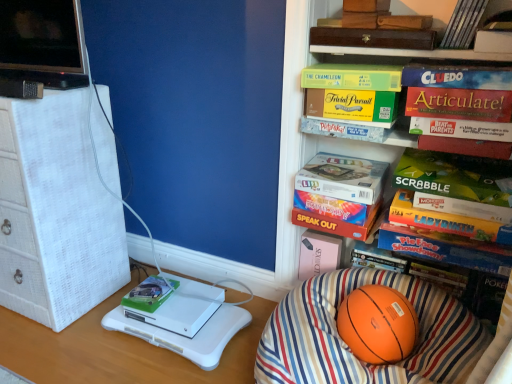
Question: Could green matte board game at upper center, the eleventh paperback book from the bottom, be considered to be inside hardcover book at center, the twelfth paperback book positioned from the top?

Choices:
 (A) yes
 (B) no

Answer: (B)

Question: Does hardcover book at center, the twelfth paperback book positioned from the top, have a greater width compared to green matte board game at upper center, which is the second paperback book from top to bottom?

Choices:
 (A) yes
 (B) no

Answer: (B)

Question: Is the position of hardcover book at center, the twelfth paperback book positioned from the top, less distant than that of green matte board game at upper center, the eleventh paperback book from the bottom?

Choices:
 (A) no
 (B) yes

Answer: (A)

Question: Are hardcover book at center, which is the first paperback book from bottom to top, and green matte board game at upper center, the eleventh paperback book from the bottom, making contact?

Choices:
 (A) no
 (B) yes

Answer: (A)

Question: Is green matte board game at upper center, the eleventh paperback book from the bottom, at the back of hardcover book at center, which is the first paperback book from bottom to top?

Choices:
 (A) no
 (B) yes

Answer: (A)

Question: In the image, is green matte scrabble board game at center-right, which appears as the eighth paperback book when viewed from the top, positioned in front of or behind hardcover book at center, the twelfth paperback book positioned from the top?

Choices:
 (A) front
 (B) behind

Answer: (A)

Question: From a real-world perspective, is green matte scrabble board game at center-right, which appears as the eighth paperback book when viewed from the top, positioned above or below hardcover book at center, which is the first paperback book from bottom to top?

Choices:
 (A) above
 (B) below

Answer: (A)

Question: Do you think green matte scrabble board game at center-right, the fifth paperback book from the bottom, is within hardcover book at center, which is the first paperback book from bottom to top, or outside of it?

Choices:
 (A) inside
 (B) outside

Answer: (B)

Question: From the image's perspective, relative to hardcover book at center, the twelfth paperback book positioned from the top, is green matte scrabble board game at center-right, which appears as the eighth paperback book when viewed from the top, above or below?

Choices:
 (A) below
 (B) above

Answer: (B)

Question: In terms of height, does orange matte basketball at lower right look taller or shorter compared to matte gold articulate! board game at upper right, the 8th paperback book in the bottom-to-top sequence?

Choices:
 (A) tall
 (B) short

Answer: (A)

Question: Looking at their shapes, would you say orange matte basketball at lower right is wider or thinner than matte gold articulate! board game at upper right, the 8th paperback book in the bottom-to-top sequence?

Choices:
 (A) thin
 (B) wide

Answer: (B)

Question: Considering the positions of point (373, 152) and point (454, 117), is point (373, 152) closer or farther from the camera than point (454, 117)?

Choices:
 (A) farther
 (B) closer

Answer: (A)

Question: From a real-world perspective, is orange matte basketball at lower right positioned above or below matte gold articulate! board game at upper right, positioned as the fifth paperback book in top-to-bottom order?

Choices:
 (A) below
 (B) above

Answer: (A)

Question: Is point (470, 31) positioned closer to the camera than point (331, 132)?

Choices:
 (A) farther
 (B) closer

Answer: (B)

Question: From the image's perspective, is hardcover book at upper right, the fourth book from the left, positioned above or below matte cardboard pictionary at upper center, which is counted as the 3th book, starting from the right?

Choices:
 (A) below
 (B) above

Answer: (B)